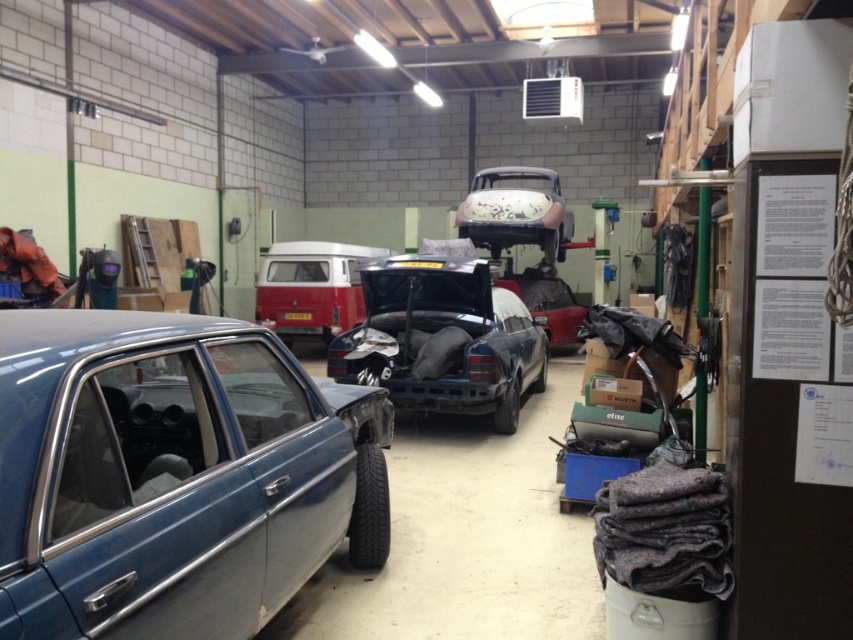
Can you confirm if rusty metal car at center is smaller than metallic silver car at center?

Incorrect, rusty metal car at center is not smaller in size than metallic silver car at center.

Does rusty metal car at center have a greater width compared to metallic silver car at center?

Correct, the width of rusty metal car at center exceeds that of metallic silver car at center.

This screenshot has height=640, width=853. I want to click on rusty metal car at center, so click(x=442, y=339).

Identify the location of rusty metal car at center. (442, 339).

Is matte white van at center to the left of metallic silver car at center from the viewer's perspective?

Yes, matte white van at center is to the left of metallic silver car at center.

What do you see at coordinates (311, 289) in the screenshot? I see `matte white van at center` at bounding box center [311, 289].

Find the location of a particular element. Image resolution: width=853 pixels, height=640 pixels. matte white van at center is located at coordinates (311, 289).

Based on the photo, between metallic blue car at lower left and rusty metal car at center, which one is positioned higher?

rusty metal car at center

Which is in front, point (22, 476) or point (515, 428)?

Point (22, 476)

Image resolution: width=853 pixels, height=640 pixels. I want to click on metallic blue car at lower left, so click(x=171, y=476).

At what (x,y) coordinates should I click in order to perform the action: click on metallic blue car at lower left. Please return your answer as a coordinate pair (x, y). Looking at the image, I should click on (171, 476).